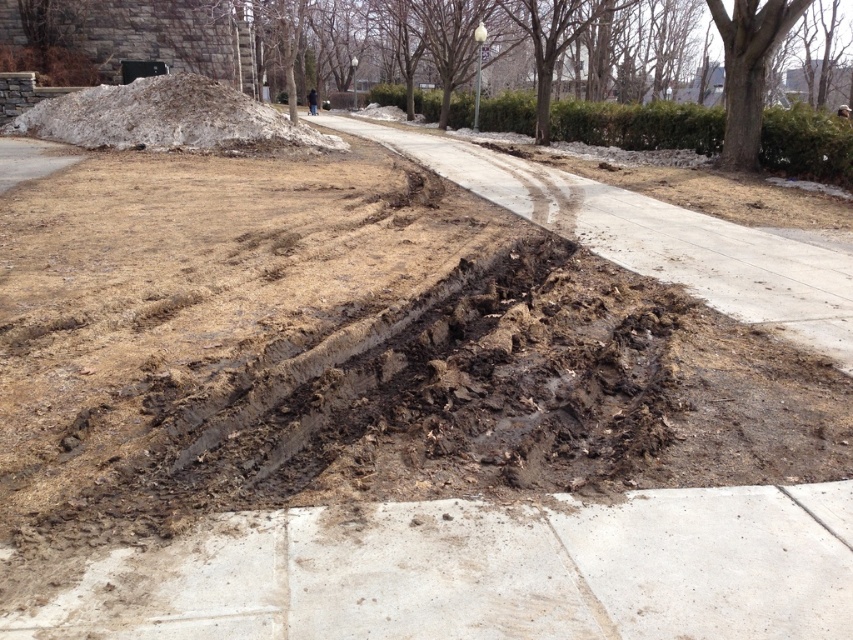
You are a delivery person trying to determine the safest path to walk on. Given the image, which object, the smooth concrete pavement at lower center or the white snow at upper left, is wider and thus provides a more stable surface for walking?

The white snow at upper left is wider than the smooth concrete pavement at lower center, making it a more stable surface for walking.